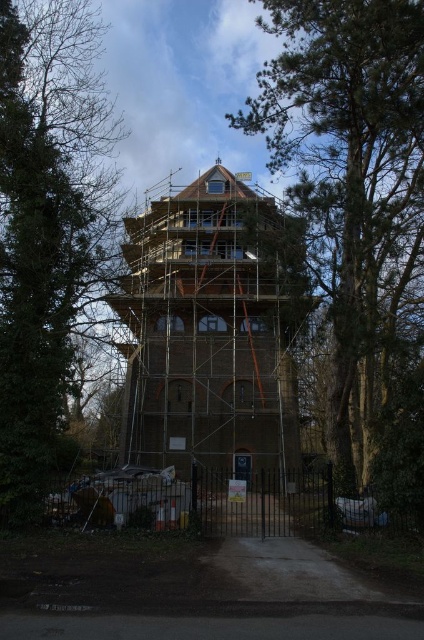
Question: Can you confirm if green textured tree at upper center is wider than green leafy tree at left?

Choices:
 (A) yes
 (B) no

Answer: (A)

Question: Based on their relative distances, which object is farther from the concrete gate at center?

Choices:
 (A) brown brick tower at center
 (B) green textured tree at upper center
 (C) green leafy tree at left

Answer: (A)

Question: Considering the relative positions of green textured tree at upper center and green leafy tree at left in the image provided, where is green textured tree at upper center located with respect to green leafy tree at left?

Choices:
 (A) above
 (B) below

Answer: (A)

Question: Which object appears closest to the camera in this image?

Choices:
 (A) green leafy tree at left
 (B) concrete gate at center

Answer: (B)

Question: From the image, what is the correct spatial relationship of green textured tree at upper center in relation to brown brick tower at center?

Choices:
 (A) right
 (B) left

Answer: (A)

Question: Based on their relative distances, which object is farther from the brown brick tower at center?

Choices:
 (A) concrete gate at center
 (B) green leafy tree at left
 (C) green textured tree at upper center

Answer: (A)